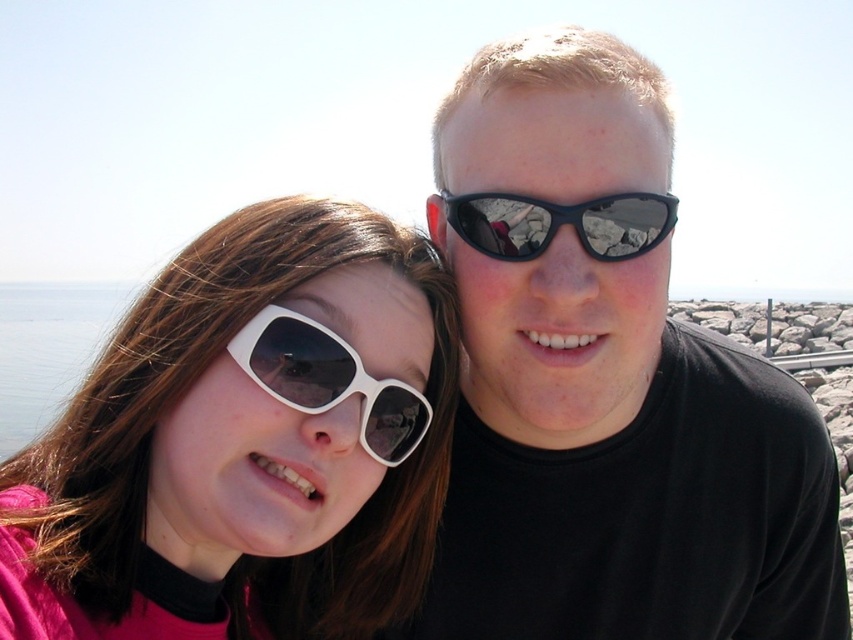
You are a photographer trying to capture the reflection of the sunglasses in the water. Since the water surface is calm, you know reflections are clear. Which sunglasses, the matte black sunglasses at upper right or the white matte sunglasses at left, would have its reflection closer to the horizon line?

The matte black sunglasses at upper right is above the white matte sunglasses at left, so its reflection would be closer to the horizon line because objects higher up have reflections closer to the horizon.

You are a photographer trying to capture a candid shot of the two people in the image. You notice the white matte sunglasses at left and the white matte sunglasses at center. Which pair of sunglasses is blocking the view of the other?

The white matte sunglasses at left is positioned under the white matte sunglasses at center, so the white matte sunglasses at center is blocking the view of the white matte sunglasses at left.